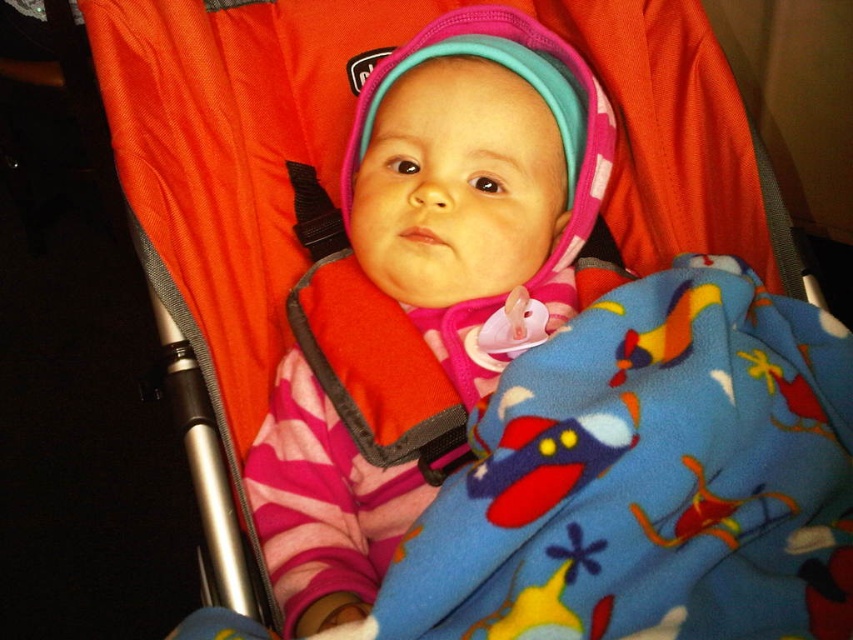
Question: Is blue fleece blanket at center below pink fleece baby at center?

Choices:
 (A) yes
 (B) no

Answer: (A)

Question: Among these points, which one is farthest from the camera?

Choices:
 (A) (440, 108)
 (B) (762, 381)

Answer: (A)

Question: Is blue fleece blanket at center above pink fleece baby at center?

Choices:
 (A) no
 (B) yes

Answer: (A)

Question: Can you confirm if blue fleece blanket at center is positioned to the right of pink fleece baby at center?

Choices:
 (A) no
 (B) yes

Answer: (B)